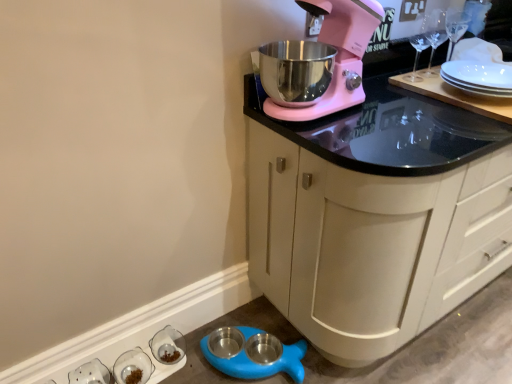
Question: From the image's perspective, is white glossy salt and pepper shakers at lower left, acting as the 3th tableware starting from the right, over blue rubber pet bowls at lower left?

Choices:
 (A) no
 (B) yes

Answer: (A)

Question: Would you say white glossy salt and pepper shakers at lower left, acting as the 3th tableware starting from the right, contains blue rubber pet bowls at lower left?

Choices:
 (A) yes
 (B) no

Answer: (B)

Question: Is white glossy salt and pepper shakers at lower left, which ranks as the 1th tableware in left-to-right order, closer to the viewer compared to blue rubber pet bowls at lower left?

Choices:
 (A) yes
 (B) no

Answer: (A)

Question: Can you confirm if white glossy salt and pepper shakers at lower left, acting as the 3th tableware starting from the right, is shorter than blue rubber pet bowls at lower left?

Choices:
 (A) yes
 (B) no

Answer: (B)

Question: Is white glossy salt and pepper shakers at lower left, acting as the 3th tableware starting from the right, smaller than blue rubber pet bowls at lower left?

Choices:
 (A) yes
 (B) no

Answer: (A)

Question: From a real-world perspective, is white glossy salt and pepper shakers at lower left, acting as the 3th tableware starting from the right, positioned over blue rubber pet bowls at lower left based on gravity?

Choices:
 (A) yes
 (B) no

Answer: (A)

Question: Considering the relative sizes of clear glass bowl at lower left, arranged as the 3th tableware when viewed from the left, and matte white cabinet at upper right in the image provided, is clear glass bowl at lower left, arranged as the 3th tableware when viewed from the left, taller than matte white cabinet at upper right?

Choices:
 (A) yes
 (B) no

Answer: (B)

Question: From the image's perspective, is clear glass bowl at lower left, the 1th tableware viewed from the right, over matte white cabinet at upper right?

Choices:
 (A) no
 (B) yes

Answer: (A)

Question: Is clear glass bowl at lower left, the 1th tableware viewed from the right, shorter than matte white cabinet at upper right?

Choices:
 (A) yes
 (B) no

Answer: (A)

Question: Is clear glass bowl at lower left, arranged as the 3th tableware when viewed from the left, oriented away from matte white cabinet at upper right?

Choices:
 (A) no
 (B) yes

Answer: (A)

Question: Is clear glass bowl at lower left, arranged as the 3th tableware when viewed from the left, positioned beyond the bounds of matte white cabinet at upper right?

Choices:
 (A) no
 (B) yes

Answer: (B)

Question: From the image's perspective, would you say clear glass bowl at lower left, the 1th tableware viewed from the right, is shown under matte white cabinet at upper right?

Choices:
 (A) no
 (B) yes

Answer: (B)

Question: From the image's perspective, would you say clear glass bowl at lower left, arranged as the 3th tableware when viewed from the left, is shown under white glossy salt and pepper shakers at lower left, acting as the 3th tableware starting from the right?

Choices:
 (A) no
 (B) yes

Answer: (A)